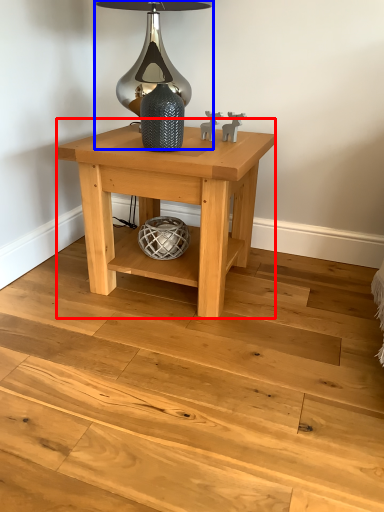
Question: Which object appears closest to the camera in this image, table (highlighted by a red box) or table lamp (highlighted by a blue box)?

Choices:
 (A) table
 (B) table lamp

Answer: (A)